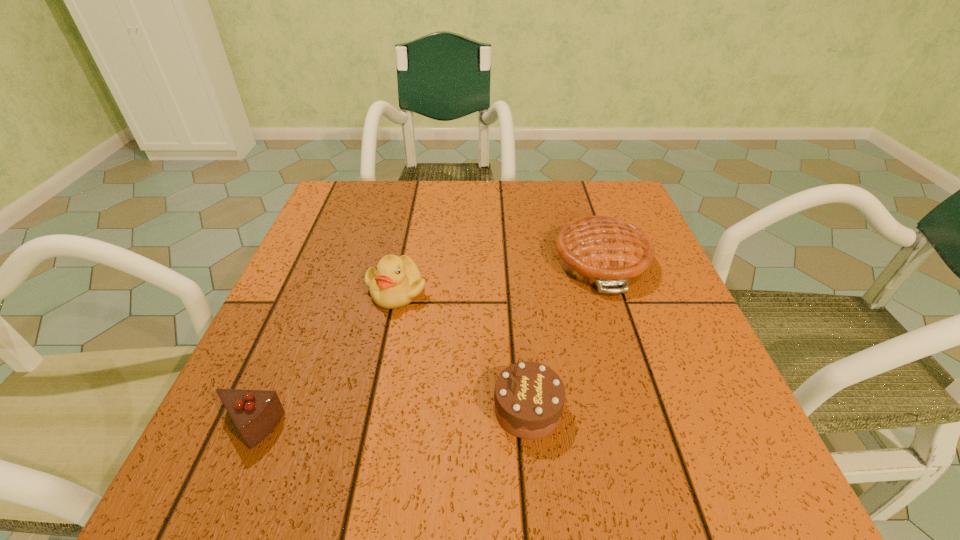
You are a GUI agent. You are given a task and a screenshot of the screen. Output one action in this format:
    pyautogui.click(x=<x>, y=<y>)
    Task: Click on the vacant region at the far left corner of the desktop
    This screenshot has height=540, width=960.
    Given the screenshot: What is the action you would take?
    pyautogui.click(x=339, y=199)

Image resolution: width=960 pixels, height=540 pixels. In the image, there is a desktop. Identify the location of blank space at the near left corner. (252, 471).

Find the location of a particular element. vacant space in between the duckling and the rightmost object is located at coordinates (499, 275).

Find the location of a particular element. This screenshot has height=540, width=960. vacant space that's between the left chocolate cake and the duckling is located at coordinates (323, 359).

This screenshot has height=540, width=960. In order to click on vacant region between the shortest object and the second object from left to right in this screenshot , I will do `click(323, 359)`.

Locate an element on the screen. The height and width of the screenshot is (540, 960). vacant point located between the right chocolate cake and the shorter chocolate cake is located at coordinates (388, 418).

You are a GUI agent. You are given a task and a screenshot of the screen. Output one action in this format:
    pyautogui.click(x=<x>, y=<y>)
    Task: Click on the free space between the third object from left to right and the duckling
    The height and width of the screenshot is (540, 960).
    Given the screenshot: What is the action you would take?
    pyautogui.click(x=462, y=349)

Where is `empty space that is in between the pie and the second object from right to left`? The image size is (960, 540). empty space that is in between the pie and the second object from right to left is located at coordinates (564, 335).

Find the location of a particular element. This screenshot has width=960, height=540. free space between the left chocolate cake and the pie is located at coordinates pyautogui.click(x=425, y=345).

Find the location of a particular element. The image size is (960, 540). free space between the leftmost object and the third object from right to left is located at coordinates (323, 359).